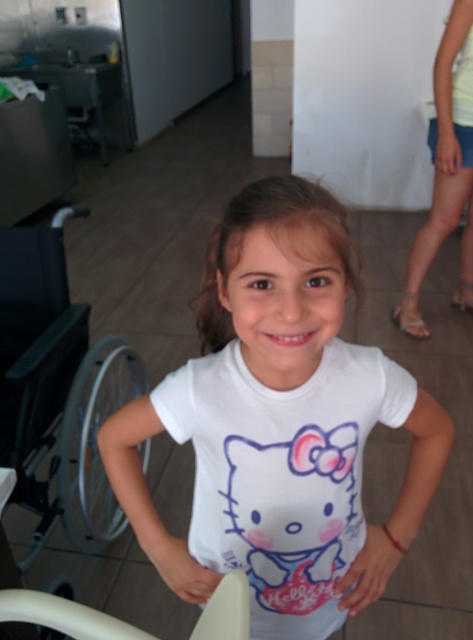
You are a photographer setting up a shoot in this scene. You need to place a small prop that must be positioned between the light yellow fabric shorts at right and the white plastic chair at lower center. Based on their positions, where should you place the prop?

The light yellow fabric shorts at right is located above the white plastic chair at lower center, so you should place the prop between them vertically, positioning it below the light yellow fabric shorts at right and above the white plastic chair at lower center.

You are designing a narrow hallway that can only fit one piece of furniture at a time. You have to choose between placing the silver metallic wheelchair at left or the white plastic chair at lower center. Which one should you choose based on their widths?

The silver metallic wheelchair at left has a smaller width than the white plastic chair at lower center, so you should choose the silver metallic wheelchair at left to fit in the narrow hallway.